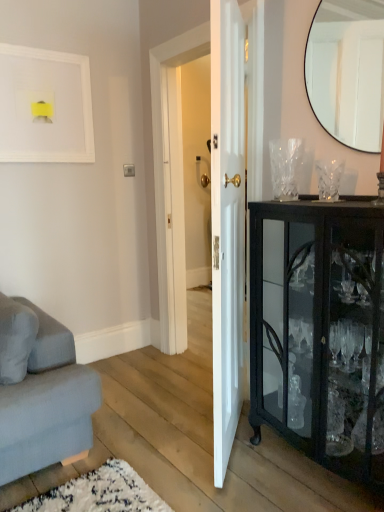
Where is `free area below black glass cabinet at right (from a real-world perspective)`? free area below black glass cabinet at right (from a real-world perspective) is located at coordinates (312, 472).